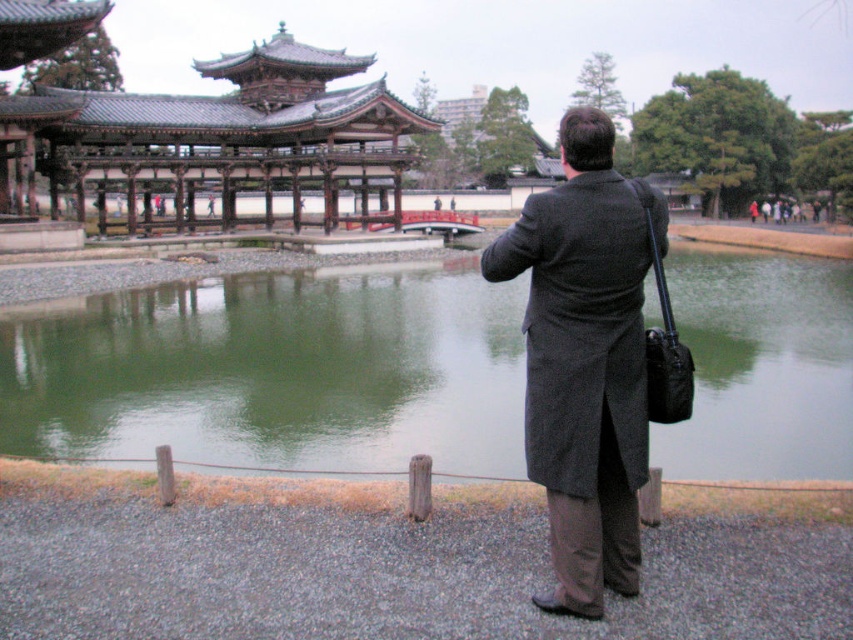
Question: Can you confirm if green water at center is smaller than dark gray wool coat at center?

Choices:
 (A) yes
 (B) no

Answer: (B)

Question: Does green water at center appear on the left side of dark gray wool coat at center?

Choices:
 (A) yes
 (B) no

Answer: (A)

Question: Which point appears closest to the camera in this image?

Choices:
 (A) (440, 426)
 (B) (635, 436)

Answer: (B)

Question: Is green water at center bigger than dark gray wool coat at center?

Choices:
 (A) no
 (B) yes

Answer: (B)